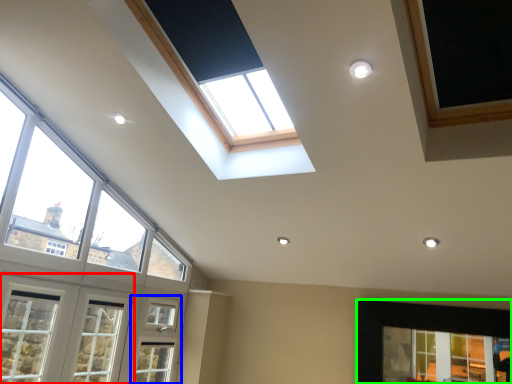
Question: Based on their relative distances, which object is farther from window (highlighted by a red box)? Choose from screen door (highlighted by a blue box) and window (highlighted by a green box).

Choices:
 (A) screen door
 (B) window

Answer: (B)